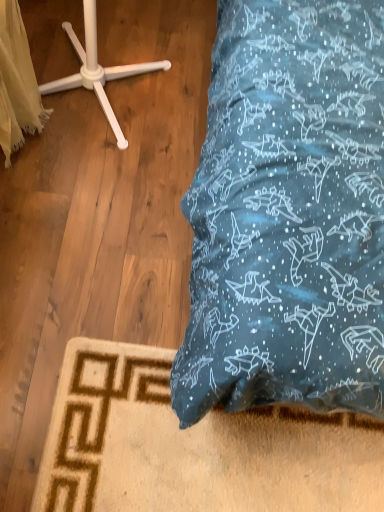
Locate an element on the screen. Image resolution: width=384 pixels, height=512 pixels. white fabric at left is located at coordinates (17, 83).

Describe the element at coordinates (17, 83) in the screenshot. I see `white fabric at left` at that location.

What do you see at coordinates (97, 69) in the screenshot? I see `white plastic coat stand at upper left` at bounding box center [97, 69].

Find the location of `white plastic coat stand at upper left`. white plastic coat stand at upper left is located at coordinates (97, 69).

Locate an element on the screen. This screenshot has width=384, height=512. white fabric at left is located at coordinates (17, 83).

Considering the positions of objects white plastic coat stand at upper left and white fabric at left in the image provided, who is more to the left, white plastic coat stand at upper left or white fabric at left?

white fabric at left is more to the left.

Is the depth of white plastic coat stand at upper left less than that of white fabric at left?

No, white plastic coat stand at upper left is further to the viewer.

Considering the positions of points (83, 7) and (5, 83), is point (83, 7) farther from camera compared to point (5, 83)?

That is True.

From the image's perspective, which object appears higher, white plastic coat stand at upper left or white fabric at left?

white plastic coat stand at upper left is shown above in the image.

From a real-world perspective, is white plastic coat stand at upper left below white fabric at left?

Yes, from a real-world perspective, white plastic coat stand at upper left is under white fabric at left.

Which object is wider, white plastic coat stand at upper left or white fabric at left?

With larger width is white plastic coat stand at upper left.

Can you confirm if white plastic coat stand at upper left is shorter than white fabric at left?

Yes.

Considering the relative sizes of white plastic coat stand at upper left and white fabric at left in the image provided, is white plastic coat stand at upper left bigger than white fabric at left?

Correct, white plastic coat stand at upper left is larger in size than white fabric at left.

Is white plastic coat stand at upper left situated inside white fabric at left or outside?

white plastic coat stand at upper left is not inside white fabric at left, it's outside.

Is white plastic coat stand at upper left positioned far away from white fabric at left?

They are positioned close to each other.

Is white fabric at left at the back of white plastic coat stand at upper left?

No, white plastic coat stand at upper left's orientation is not away from white fabric at left.

What's the angular difference between white plastic coat stand at upper left and white fabric at left's facing directions?

3.49 degrees separate the facing orientations of white plastic coat stand at upper left and white fabric at left.

Image resolution: width=384 pixels, height=512 pixels. In the image, there is a white plastic coat stand at upper left. Identify the location of material below it (from the image's perspective). (17, 83).

Is white fabric at left to the left of white plastic coat stand at upper left from the viewer's perspective?

Indeed, white fabric at left is positioned on the left side of white plastic coat stand at upper left.

Is white fabric at left in front of or behind white plastic coat stand at upper left in the image?

Clearly, white fabric at left is in front of white plastic coat stand at upper left.

From the picture: Which is farther, (16, 42) or (111, 68)?

The point (111, 68) is farther from the camera.

From the image's perspective, which object appears higher, white fabric at left or white plastic coat stand at upper left?

white plastic coat stand at upper left appears higher in the image.

From a real-world perspective, which object stands above the other?

white fabric at left.

Between white fabric at left and white plastic coat stand at upper left, which one has smaller width?

With smaller width is white fabric at left.

From the picture: Does white fabric at left have a greater height compared to white plastic coat stand at upper left?

Correct, white fabric at left is much taller as white plastic coat stand at upper left.

Considering the sizes of objects white fabric at left and white plastic coat stand at upper left in the image provided, who is bigger, white fabric at left or white plastic coat stand at upper left?

With larger size is white plastic coat stand at upper left.

Is white plastic coat stand at upper left inside white fabric at left?

No, white plastic coat stand at upper left is not surrounded by white fabric at left.

From the picture: Is white fabric at left positioned far away from white plastic coat stand at upper left?

No, there isn't a large distance between white fabric at left and white plastic coat stand at upper left.

Is white fabric at left oriented towards white plastic coat stand at upper left?

Yes, white fabric at left is facing white plastic coat stand at upper left.

From the picture: How far apart are white fabric at left and white plastic coat stand at upper left?

white fabric at left is 9.16 inches away from white plastic coat stand at upper left.

In the image, there is a white fabric at left. Find the location of `furniture above it (from the image's perspective)`. furniture above it (from the image's perspective) is located at coordinates (97, 69).

You are a GUI agent. You are given a task and a screenshot of the screen. Output one action in this format:
    pyautogui.click(x=<x>, y=<y>)
    Task: Click on the furniture directly beneath the white fabric at left (from a real-world perspective)
    
    Given the screenshot: What is the action you would take?
    pyautogui.click(x=97, y=69)

This screenshot has width=384, height=512. Identify the location of furniture behind the white fabric at left. (97, 69).